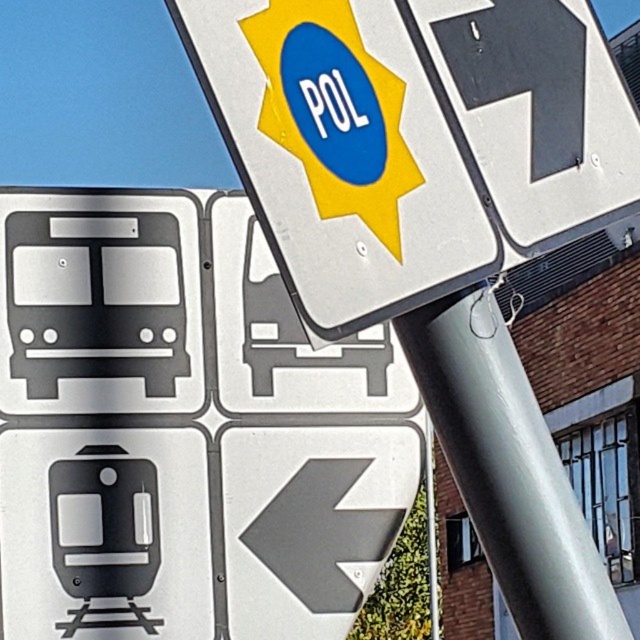
You are standing in front of the traffic sign and notice two points marked on it. The first point is at coordinates point (554, 604) and the second is at point (339, 604). Which point is closer to you?

Point (554, 604) is in front of point (339, 604), so the first point is closer to you.

You are a delivery driver trying to park your vehicle near the traffic sign. The parking spot is directly behind the silver metallic pole at center. Can you see the metallic silver sign at upper center from your parking spot?

The metallic silver sign at upper center is located above the silver metallic pole at center, so if you are parked directly behind the pole, you should still be able to see the sign above it as long as there are no obstructions blocking your view.